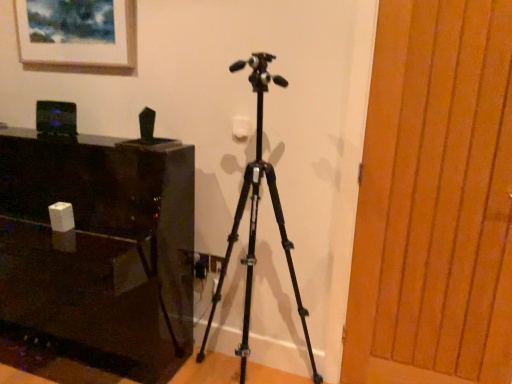
Question: From the image's perspective, relative to glossy black table at left, is black matte tripod at center above or below?

Choices:
 (A) above
 (B) below

Answer: (A)

Question: Looking at their shapes, would you say black matte tripod at center is wider or thinner than glossy black table at left?

Choices:
 (A) thin
 (B) wide

Answer: (A)

Question: Which object is the closest to the wooden door at right?

Choices:
 (A) matte wooden picture frame at upper left
 (B) glossy black table at left
 (C) black matte tripod at center

Answer: (C)

Question: Which of these objects is positioned closest to the black matte tripod at center?

Choices:
 (A) matte wooden picture frame at upper left
 (B) wooden door at right
 (C) glossy black table at left

Answer: (C)